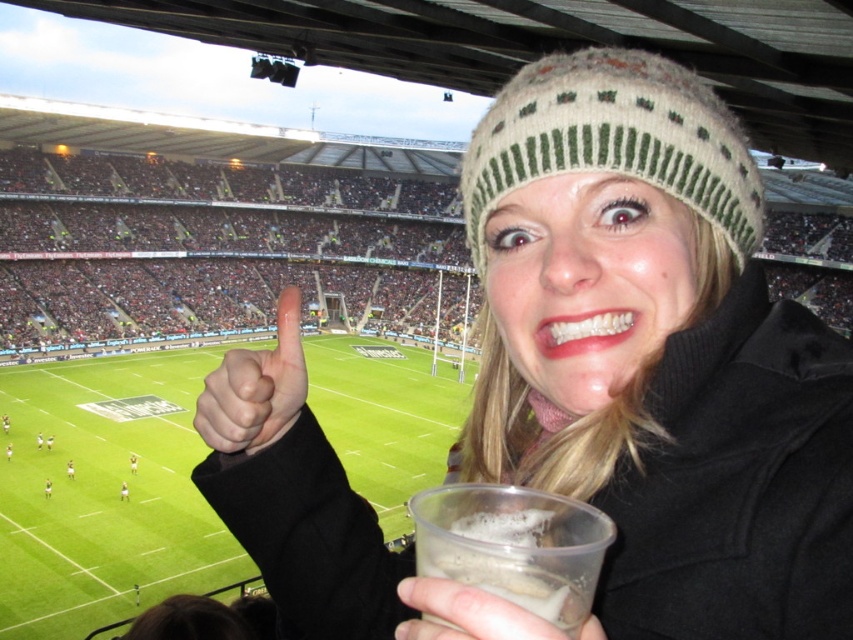
Is point (581, 116) positioned in front of point (437, 582)?

That is False.

Is the position of knitted woolen hat at upper center less distant than that of clear plastic cup at lower center?

No, knitted woolen hat at upper center is further to the viewer.

Where is `knitted woolen hat at upper center`? The width and height of the screenshot is (853, 640). knitted woolen hat at upper center is located at coordinates (614, 140).

At what (x,y) coordinates should I click in order to perform the action: click on knitted woolen hat at upper center. Please return your answer as a coordinate pair (x, y). Looking at the image, I should click on (614, 140).

Which is more to the right, translucent plastic cup at lower center or clear plastic cup at lower center?

From the viewer's perspective, translucent plastic cup at lower center appears more on the right side.

Which of these two, translucent plastic cup at lower center or clear plastic cup at lower center, stands taller?

Standing taller between the two is translucent plastic cup at lower center.

Does point (508, 564) lie behind point (421, 580)?

No, it is not.

What are the coordinates of `translucent plastic cup at lower center` in the screenshot? It's located at (515, 554).

Can you confirm if translucent plastic cup at lower center is positioned above white matte hand at center?

No, translucent plastic cup at lower center is not above white matte hand at center.

Who is higher up, translucent plastic cup at lower center or white matte hand at center?

Positioned higher is white matte hand at center.

Identify the location of translucent plastic cup at lower center. The width and height of the screenshot is (853, 640). point(515,554).